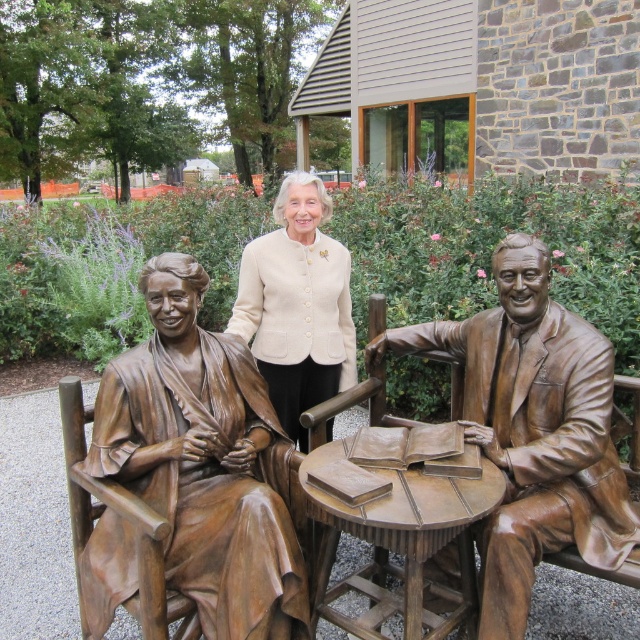
You are standing at the entrance of the park and want to take a photo of the bronze statue of couple at center. According to the scene description, where should you position yourself to capture the statue in the frame?

The bronze statue of couple at center is located at point (492, 250), so you should position yourself at a spot that aligns with these coordinates to ensure the statue is centered in your photo.

You are a photographer trying to capture both the bronze statue at left and the beige woolen jacket at center in a single frame. Since you want to emphasize the statue, which object should you position closer to the camera to achieve this effect?

To emphasize the bronze statue at left, position it closer to the camera since it is larger in size than the beige woolen jacket at center.

You are a photographer trying to capture a clear shot of the bronze statue of couple at center without the beige woolen jacket at center blocking the view. Based on their positions, which side should you move to in order to frame the statue without the jacket in the way?

The bronze statue of couple at center is positioned on the right side of beige woolen jacket at center. To avoid the jacket blocking the view, you should move to the left side of the beige woolen jacket at center so that the statue is on the right and the jacket is out of frame.